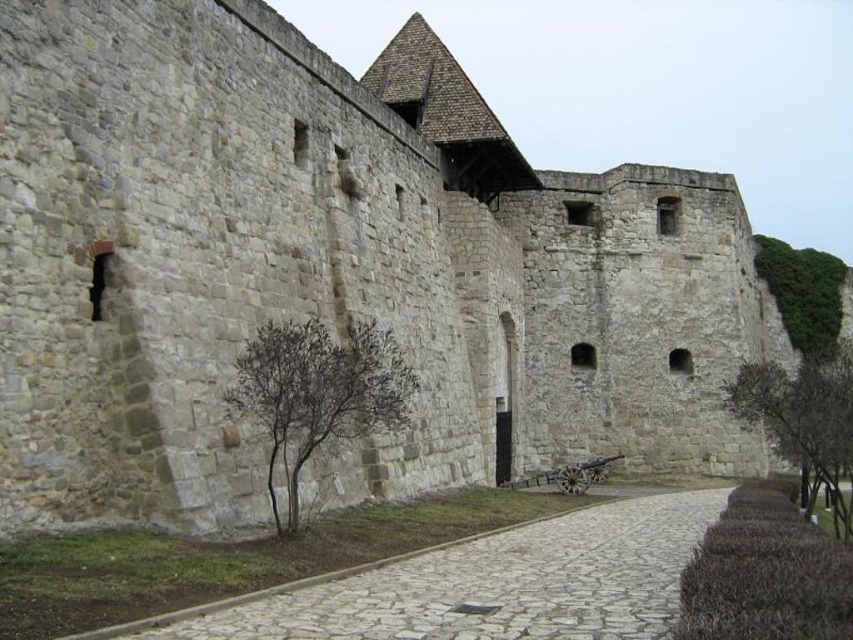
Does pebble stone path at center appear under brown textured tree at center?

Yes, pebble stone path at center is below brown textured tree at center.

Between point (599, 513) and point (338, 353), which one is positioned in front?

Point (338, 353) is more forward.

Which is in front, point (602, 609) or point (231, 385)?

Positioned in front is point (602, 609).

Locate an element on the screen. This screenshot has height=640, width=853. pebble stone path at center is located at coordinates (483, 584).

Is brown textured tree at center taller than brown leafy tree at right?

In fact, brown textured tree at center may be shorter than brown leafy tree at right.

Can you confirm if brown textured tree at center is positioned below brown leafy tree at right?

No.

Does point (281, 408) lie in front of point (764, 429)?

Yes, point (281, 408) is in front of point (764, 429).

Where is `brown textured tree at center`? This screenshot has width=853, height=640. brown textured tree at center is located at coordinates (318, 392).

Is pebble stone path at center above brown leafy tree at right?

No, pebble stone path at center is not above brown leafy tree at right.

Describe the element at coordinates (483, 584) in the screenshot. I see `pebble stone path at center` at that location.

Between point (567, 532) and point (819, 470), which one is positioned in front?

Point (567, 532) is more forward.

You are a GUI agent. You are given a task and a screenshot of the screen. Output one action in this format:
    pyautogui.click(x=<x>, y=<y>)
    Task: Click on the pebble stone path at center
    
    Given the screenshot: What is the action you would take?
    pyautogui.click(x=483, y=584)